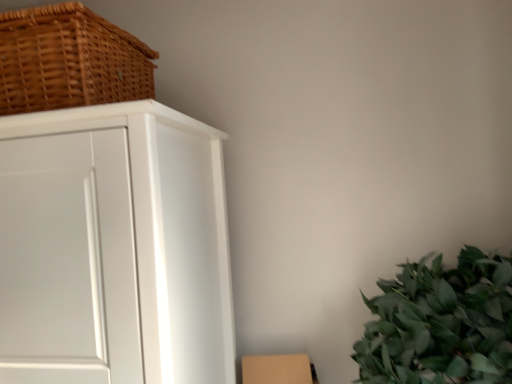
Question: Does woven brown basket at upper left lie behind brown cardboard box at lower right?

Choices:
 (A) no
 (B) yes

Answer: (A)

Question: Is woven brown basket at upper left in contact with brown cardboard box at lower right?

Choices:
 (A) no
 (B) yes

Answer: (A)

Question: Is woven brown basket at upper left wider than brown cardboard box at lower right?

Choices:
 (A) yes
 (B) no

Answer: (A)

Question: From a real-world perspective, is woven brown basket at upper left positioned under brown cardboard box at lower right based on gravity?

Choices:
 (A) no
 (B) yes

Answer: (A)

Question: From a real-world perspective, is woven brown basket at upper left over brown cardboard box at lower right?

Choices:
 (A) no
 (B) yes

Answer: (B)

Question: From a real-world perspective, is white matte cabinet at left positioned above or below woven brown basket at upper left?

Choices:
 (A) below
 (B) above

Answer: (A)

Question: In terms of height, does white matte cabinet at left look taller or shorter compared to woven brown basket at upper left?

Choices:
 (A) short
 (B) tall

Answer: (B)

Question: In terms of size, does white matte cabinet at left appear bigger or smaller than woven brown basket at upper left?

Choices:
 (A) big
 (B) small

Answer: (A)

Question: Would you say white matte cabinet at left is to the left or to the right of woven brown basket at upper left in the picture?

Choices:
 (A) right
 (B) left

Answer: (A)

Question: From a real-world perspective, relative to brown cardboard box at lower right, is white matte cabinet at left vertically above or below?

Choices:
 (A) below
 (B) above

Answer: (B)

Question: In terms of height, does white matte cabinet at left look taller or shorter compared to brown cardboard box at lower right?

Choices:
 (A) tall
 (B) short

Answer: (A)

Question: Considering the relative positions of white matte cabinet at left and brown cardboard box at lower right in the image provided, is white matte cabinet at left to the left or to the right of brown cardboard box at lower right?

Choices:
 (A) right
 (B) left

Answer: (B)

Question: From the image's perspective, is white matte cabinet at left above or below brown cardboard box at lower right?

Choices:
 (A) below
 (B) above

Answer: (B)

Question: Is woven brown basket at upper left inside the boundaries of white matte cabinet at left, or outside?

Choices:
 (A) outside
 (B) inside

Answer: (A)

Question: In the image, is woven brown basket at upper left positioned in front of or behind white matte cabinet at left?

Choices:
 (A) front
 (B) behind

Answer: (B)